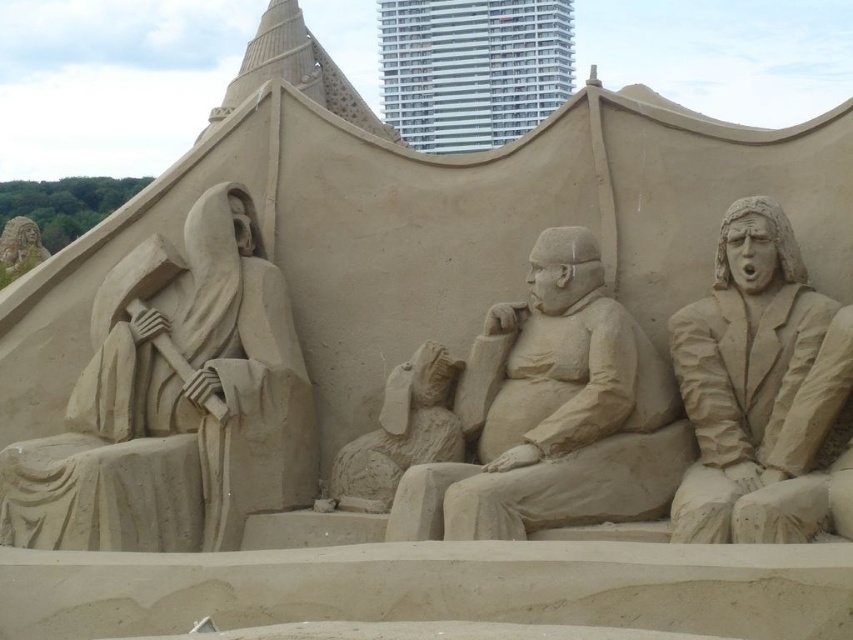
You are an artist who wants to place a new sand sculpture between the smooth sand sculpture at center and the smooth sand rabbit at center. The new sculpture is 2 meters wide. Can you fit it between them without moving the existing sculptures?

The distance between the smooth sand sculpture at center and the smooth sand rabbit at center is 5.23 meters. Since the new sculpture is 2 meters wide, there is enough space between them to place it without moving the existing sculptures.

Based on the scene description, which sand figure has a greater width, the smooth sand sculpture at left or the smooth sand figure at right?

The smooth sand sculpture at left has a greater width than the smooth sand figure at right.

You are an artist trying to carve a new sand sculpture. You see the smooth sand sculpture at center and the smooth sand rabbit at center. Which one is located higher up?

The smooth sand sculpture at center is positioned over the smooth sand rabbit at center, so it is higher up.